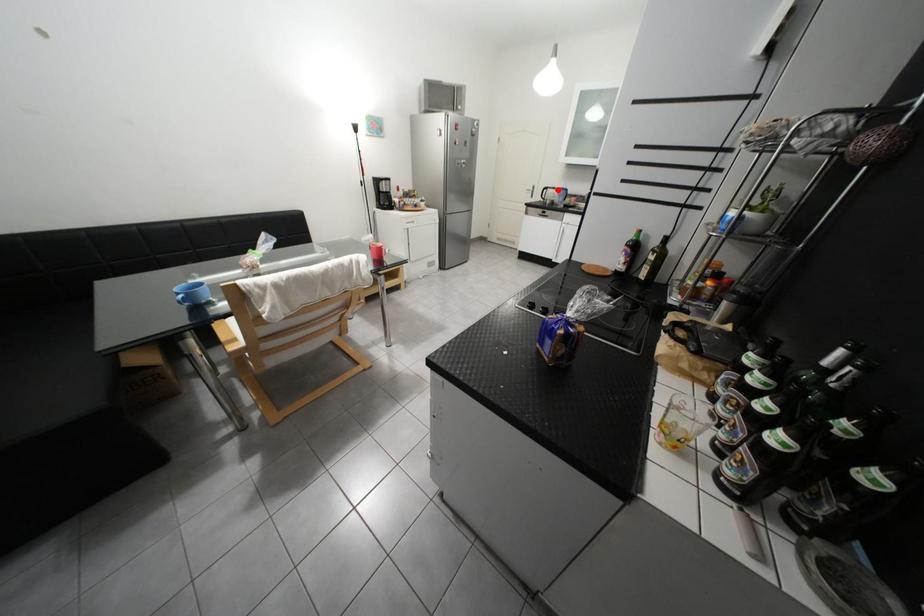
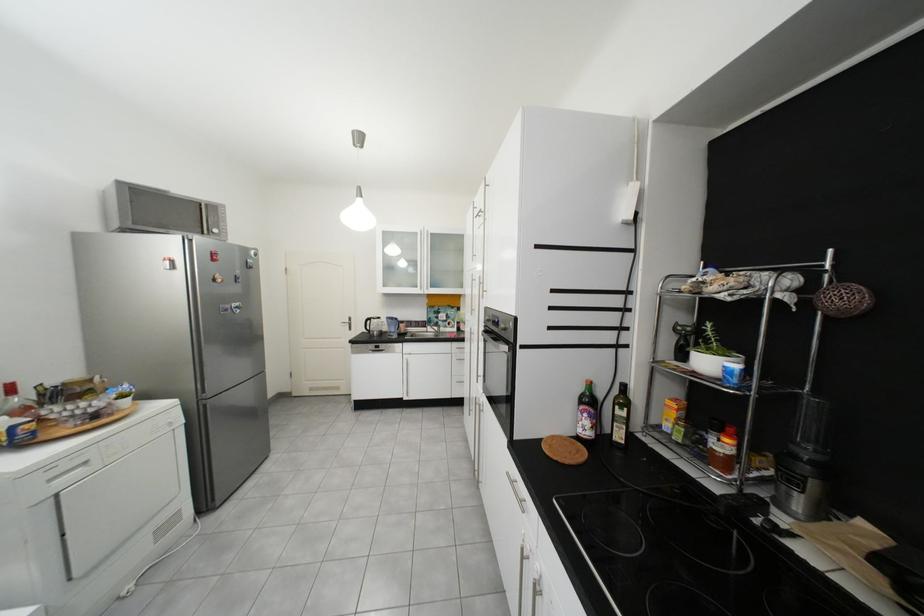
In the second image, find the point that corresponds to the highlighted location in the first image.

(381, 321)